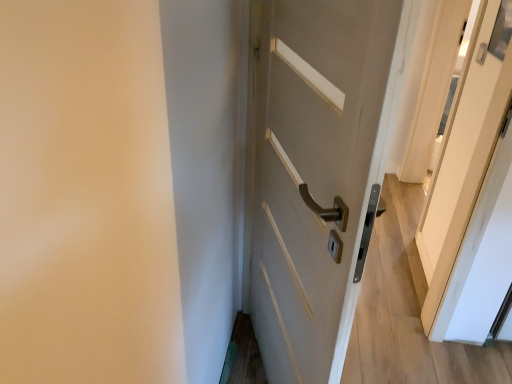
Where is `matte white door at center`? matte white door at center is located at coordinates (315, 176).

The image size is (512, 384). Describe the element at coordinates (315, 176) in the screenshot. I see `matte white door at center` at that location.

Describe the element at coordinates (466, 150) in the screenshot. The image size is (512, 384). I see `white glossy screen door at upper right` at that location.

The image size is (512, 384). What are the coordinates of `white glossy screen door at upper right` in the screenshot? It's located at (466, 150).

Find the location of `matte white door at center`. matte white door at center is located at coordinates (315, 176).

Is white glossy screen door at upper right at the right side of matte white door at center?

Indeed, white glossy screen door at upper right is positioned on the right side of matte white door at center.

Which object is further away from the camera, white glossy screen door at upper right or matte white door at center?

white glossy screen door at upper right is behind.

Between point (451, 179) and point (278, 264), which one is positioned behind?

Point (451, 179)

From the image's perspective, which is below, white glossy screen door at upper right or matte white door at center?

matte white door at center is shown below in the image.

From a real-world perspective, which object stands above the other?

matte white door at center, from a real-world perspective.

Between white glossy screen door at upper right and matte white door at center, which one has larger width?

With larger width is matte white door at center.

Considering the relative sizes of white glossy screen door at upper right and matte white door at center in the image provided, is white glossy screen door at upper right taller than matte white door at center?

Incorrect, the height of white glossy screen door at upper right is not larger of that of matte white door at center.

Is white glossy screen door at upper right bigger than matte white door at center?

No, white glossy screen door at upper right is not bigger than matte white door at center.

Could matte white door at center be considered to be inside white glossy screen door at upper right?

That's incorrect, matte white door at center is not inside white glossy screen door at upper right.

Are white glossy screen door at upper right and matte white door at center located far from each other?

They are positioned close to each other.

Does white glossy screen door at upper right turn towards matte white door at center?

No, white glossy screen door at upper right is not oriented towards matte white door at center.

How different are the orientations of white glossy screen door at upper right and matte white door at center in degrees?

158 degrees separate the facing orientations of white glossy screen door at upper right and matte white door at center.

Locate an element on the screen. Image resolution: width=512 pixels, height=384 pixels. screen door on the right of matte white door at center is located at coordinates (466, 150).

Which is more to the left, matte white door at center or white glossy screen door at upper right?

matte white door at center is more to the left.

Which is behind, matte white door at center or white glossy screen door at upper right?

white glossy screen door at upper right is further from the camera.

Considering the positions of points (334, 50) and (479, 148), is point (334, 50) closer to camera compared to point (479, 148)?

Yes.

From the image's perspective, which one is positioned higher, matte white door at center or white glossy screen door at upper right?

white glossy screen door at upper right, from the image's perspective.

From a real-world perspective, is matte white door at center under white glossy screen door at upper right?

Actually, matte white door at center is physically above white glossy screen door at upper right in the real world.

Is matte white door at center wider than white glossy screen door at upper right?

Yes, matte white door at center is wider than white glossy screen door at upper right.

Is matte white door at center taller or shorter than white glossy screen door at upper right?

matte white door at center is taller than white glossy screen door at upper right.

Which of these two, matte white door at center or white glossy screen door at upper right, is smaller?

Smaller between the two is white glossy screen door at upper right.

Is white glossy screen door at upper right a part of matte white door at center?

No, white glossy screen door at upper right is not a part of matte white door at center.

Is matte white door at center far away from white glossy screen door at upper right?

That's not correct — matte white door at center is a little close to white glossy screen door at upper right.

Is matte white door at center facing away from white glossy screen door at upper right?

No.

In the image, there is a matte white door at center. Where is `screen door below it (from a real-world perspective)`? The image size is (512, 384). screen door below it (from a real-world perspective) is located at coordinates (466, 150).

Locate an element on the screen. The width and height of the screenshot is (512, 384). door on the left of white glossy screen door at upper right is located at coordinates (315, 176).

At what (x,y) coordinates should I click in order to perform the action: click on screen door on the right of matte white door at center. Please return your answer as a coordinate pair (x, y). The image size is (512, 384). Looking at the image, I should click on [466, 150].